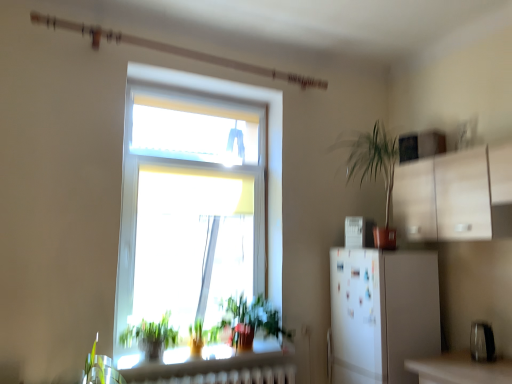
The height and width of the screenshot is (384, 512). What do you see at coordinates (355, 232) in the screenshot?
I see `white glossy refrigerator at right, which appears as the second appliance when ordered from the bottom` at bounding box center [355, 232].

Where is `green leafy plant at lower left, which is counted as the 2th vegetation, starting from the right`? The width and height of the screenshot is (512, 384). green leafy plant at lower left, which is counted as the 2th vegetation, starting from the right is located at coordinates (151, 337).

Between green leafy plant at lower center, acting as the first vegetation starting from the right, and white glossy refrigerator at right, the 1th appliance when ordered from left to right, which one has larger size?

With larger size is green leafy plant at lower center, acting as the first vegetation starting from the right.

From the picture: From a real-world perspective, is green leafy plant at lower center, acting as the first vegetation starting from the right, on top of white glossy refrigerator at right, the 1th appliance when ordered from left to right?

Incorrect, from a real-world perspective, green leafy plant at lower center, acting as the first vegetation starting from the right, is lower than white glossy refrigerator at right, the 1th appliance when ordered from left to right.

Which is behind, point (246, 316) or point (362, 218)?

The point (362, 218) is behind.

Which object is positioned more to the right, white glossy refrigerator at right, which is the first appliance in back-to-front order, or metallic silver toaster at lower right, which is counted as the 2th appliance, starting from the left?

metallic silver toaster at lower right, which is counted as the 2th appliance, starting from the left, is more to the right.

Can you confirm if white glossy refrigerator at right, which is the first appliance in back-to-front order, is taller than metallic silver toaster at lower right, the 2th appliance when ordered from back to front?

Correct, white glossy refrigerator at right, which is the first appliance in back-to-front order, is much taller as metallic silver toaster at lower right, the 2th appliance when ordered from back to front.

From a real-world perspective, which object rests below the other?

metallic silver toaster at lower right, which is counted as the 2th appliance, starting from the left, from a real-world perspective.

Locate an element on the screen. The image size is (512, 384). appliance lying in front of the white glossy refrigerator at right, the 2th appliance when ordered from right to left is located at coordinates (482, 342).

From the metallic silver toaster at lower right, which is counted as the 2th appliance, starting from the left, count the 2nd vegetation to the left and point to it. Please provide its 2D coordinates.

[(151, 337)]

Is green leafy plant at lower left, the first vegetation in the left-to-right sequence, oriented away from metallic silver toaster at lower right, positioned as the 2th appliance in top-to-bottom order?

That's not correct — green leafy plant at lower left, the first vegetation in the left-to-right sequence, is not looking away from metallic silver toaster at lower right, positioned as the 2th appliance in top-to-bottom order.

How far apart are green leafy plant at lower left, which is counted as the 2th vegetation, starting from the right, and metallic silver toaster at lower right, placed as the first appliance when sorted from front to back?

green leafy plant at lower left, which is counted as the 2th vegetation, starting from the right, is 6.62 feet from metallic silver toaster at lower right, placed as the first appliance when sorted from front to back.

Considering the relative sizes of green leafy plant at lower left, which is counted as the 2th vegetation, starting from the right, and metallic silver toaster at lower right, which is counted as the 2th appliance, starting from the left, in the image provided, is green leafy plant at lower left, which is counted as the 2th vegetation, starting from the right, shorter than metallic silver toaster at lower right, which is counted as the 2th appliance, starting from the left,?

No.

Based on their sizes in the image, would you say white glossy refrigerator at right, which is the first appliance in back-to-front order, is bigger or smaller than green leafy plant at lower left, which is counted as the 2th vegetation, starting from the right?

Considering their sizes, white glossy refrigerator at right, which is the first appliance in back-to-front order, takes up less space than green leafy plant at lower left, which is counted as the 2th vegetation, starting from the right.

Find the location of a particular element. This screenshot has width=512, height=384. appliance above the green leafy plant at lower left, which is counted as the 2th vegetation, starting from the right (from the image's perspective) is located at coordinates (355, 232).

From the image's perspective, is white glossy refrigerator at right, acting as the first appliance starting from the top, over green leafy plant at lower left, the first vegetation in the left-to-right sequence?

Yes, from the image's perspective, white glossy refrigerator at right, acting as the first appliance starting from the top, is on top of green leafy plant at lower left, the first vegetation in the left-to-right sequence.

Is white glossy refrigerator at right, which appears as the second appliance when ordered from the bottom, further to camera compared to green leafy plant at lower left, the first vegetation in the left-to-right sequence?

Yes.

Which is behind, green leafy plant at lower left, the first vegetation in the left-to-right sequence, or white glossy refrigerator at right, which is the first appliance in back-to-front order?

Positioned behind is white glossy refrigerator at right, which is the first appliance in back-to-front order.

In the scene shown: Which of these two, green leafy plant at lower left, which is counted as the 2th vegetation, starting from the right, or white glossy refrigerator at right, the second appliance positioned from the front, stands shorter?

Standing shorter between the two is white glossy refrigerator at right, the second appliance positioned from the front.

Is green leafy plant at lower left, which is counted as the 2th vegetation, starting from the right, at the left side of white glossy refrigerator at right, acting as the first appliance starting from the top?

Yes, green leafy plant at lower left, which is counted as the 2th vegetation, starting from the right, is to the left of white glossy refrigerator at right, acting as the first appliance starting from the top.

From a real-world perspective, is green leafy plant at lower left, the first vegetation in the left-to-right sequence, physically located above or below white glossy refrigerator at right, the 2th appliance when ordered from right to left?

green leafy plant at lower left, the first vegetation in the left-to-right sequence, is below white glossy refrigerator at right, the 2th appliance when ordered from right to left.

From a real-world perspective, is green leafy plant at lower center, acting as the first vegetation starting from the right, above or below green leafy plant at lower left, the first vegetation in the left-to-right sequence?

From a real-world perspective, green leafy plant at lower center, acting as the first vegetation starting from the right, is physically above green leafy plant at lower left, the first vegetation in the left-to-right sequence.

Is green leafy plant at lower left, which is counted as the 2th vegetation, starting from the right, located within green leafy plant at lower center, the 2th vegetation from the left?

No.

This screenshot has height=384, width=512. In order to click on vegetation behind the green leafy plant at lower left, which is counted as the 2th vegetation, starting from the right in this screenshot , I will do `click(250, 320)`.

Is green leafy plant at lower center, acting as the first vegetation starting from the right, bigger than green leafy plant at lower left, which is counted as the 2th vegetation, starting from the right?

Yes.

Is metallic silver toaster at lower right, the 1th appliance in the right-to-left sequence, spatially inside green leafy plant at lower left, which is counted as the 2th vegetation, starting from the right, or outside of it?

metallic silver toaster at lower right, the 1th appliance in the right-to-left sequence, is located beyond the bounds of green leafy plant at lower left, which is counted as the 2th vegetation, starting from the right.

Which of these two, metallic silver toaster at lower right, positioned as the 2th appliance in top-to-bottom order, or green leafy plant at lower left, the first vegetation in the left-to-right sequence, stands shorter?

With less height is metallic silver toaster at lower right, positioned as the 2th appliance in top-to-bottom order.

Is metallic silver toaster at lower right, the 1th appliance in the right-to-left sequence, far from green leafy plant at lower left, which is counted as the 2th vegetation, starting from the right?

Absolutely, metallic silver toaster at lower right, the 1th appliance in the right-to-left sequence, is distant from green leafy plant at lower left, which is counted as the 2th vegetation, starting from the right.

Considering the sizes of objects metallic silver toaster at lower right, the 2th appliance when ordered from back to front, and green leafy plant at lower left, which is counted as the 2th vegetation, starting from the right, in the image provided, who is smaller, metallic silver toaster at lower right, the 2th appliance when ordered from back to front, or green leafy plant at lower left, which is counted as the 2th vegetation, starting from the right,?

metallic silver toaster at lower right, the 2th appliance when ordered from back to front, is smaller.

This screenshot has width=512, height=384. Find the location of `appliance behind the green leafy plant at lower center, acting as the first vegetation starting from the right`. appliance behind the green leafy plant at lower center, acting as the first vegetation starting from the right is located at coordinates (355, 232).

I want to click on appliance that is under the white glossy refrigerator at right, the 1th appliance when ordered from left to right (from a real-world perspective), so click(x=482, y=342).

Considering their positions, is green leafy plant at lower center, the 2th vegetation from the left, positioned further to metallic silver toaster at lower right, positioned as the 2th appliance in top-to-bottom order, than white glossy refrigerator at right, the 2th appliance when ordered from right to left?

green leafy plant at lower center, the 2th vegetation from the left, is further to metallic silver toaster at lower right, positioned as the 2th appliance in top-to-bottom order.

Estimate the real-world distances between objects in this image. Which object is further from green leafy plant at lower left, which is counted as the 2th vegetation, starting from the right, white glossy refrigerator at right, which is the first appliance in back-to-front order, or green leafy plant at lower center, acting as the first vegetation starting from the right?

Among the two, white glossy refrigerator at right, which is the first appliance in back-to-front order, is located further to green leafy plant at lower left, which is counted as the 2th vegetation, starting from the right.

When comparing their distances from metallic silver toaster at lower right, the 1th appliance in the right-to-left sequence, does green leafy plant at lower left, which is counted as the 2th vegetation, starting from the right, or white glossy refrigerator at right, the 2th appliance when ordered from right to left, seem further?

Among the two, green leafy plant at lower left, which is counted as the 2th vegetation, starting from the right, is located further to metallic silver toaster at lower right, the 1th appliance in the right-to-left sequence.

Which object lies further to the anchor point white glossy refrigerator at right, which is the first appliance in back-to-front order, metallic silver toaster at lower right, the 1th appliance from the bottom, or green leafy plant at lower center, acting as the first vegetation starting from the right?

Based on the image, metallic silver toaster at lower right, the 1th appliance from the bottom, appears to be further to white glossy refrigerator at right, which is the first appliance in back-to-front order.

When comparing their distances from metallic silver toaster at lower right, the 1th appliance in the right-to-left sequence, does green leafy plant at lower center, acting as the first vegetation starting from the right, or green leafy plant at lower left, which is counted as the 2th vegetation, starting from the right, seem further?

Among the two, green leafy plant at lower left, which is counted as the 2th vegetation, starting from the right, is located further to metallic silver toaster at lower right, the 1th appliance in the right-to-left sequence.

Based on their spatial positions, is green leafy plant at lower center, acting as the first vegetation starting from the right, or white glossy refrigerator at right, acting as the first appliance starting from the top, closer to green leafy plant at lower left, the first vegetation in the left-to-right sequence?

Based on the image, green leafy plant at lower center, acting as the first vegetation starting from the right, appears to be nearer to green leafy plant at lower left, the first vegetation in the left-to-right sequence.

Estimate the real-world distances between objects in this image. Which object is further from green leafy plant at lower center, acting as the first vegetation starting from the right, green leafy plant at lower left, the first vegetation in the left-to-right sequence, or white glossy refrigerator at right, which is the first appliance in back-to-front order?

The object further to green leafy plant at lower center, acting as the first vegetation starting from the right, is white glossy refrigerator at right, which is the first appliance in back-to-front order.

Estimate the real-world distances between objects in this image. Which object is further from metallic silver toaster at lower right, which is counted as the 2th appliance, starting from the left, white glossy refrigerator at right, the 1th appliance when ordered from left to right, or green leafy plant at lower center, the 2th vegetation from the left?

The object further to metallic silver toaster at lower right, which is counted as the 2th appliance, starting from the left, is green leafy plant at lower center, the 2th vegetation from the left.

Locate an element on the screen. The image size is (512, 384). appliance between green leafy plant at lower left, the first vegetation in the left-to-right sequence, and metallic silver toaster at lower right, the 1th appliance in the right-to-left sequence is located at coordinates (x=355, y=232).

Where is `vegetation located between green leafy plant at lower left, which is counted as the 2th vegetation, starting from the right, and white glossy refrigerator at right, the 1th appliance when ordered from left to right, in the left-right direction`? This screenshot has height=384, width=512. vegetation located between green leafy plant at lower left, which is counted as the 2th vegetation, starting from the right, and white glossy refrigerator at right, the 1th appliance when ordered from left to right, in the left-right direction is located at coordinates (250, 320).

Identify the location of vegetation between green leafy plant at lower left, the first vegetation in the left-to-right sequence, and metallic silver toaster at lower right, the 1th appliance from the bottom, in the horizontal direction. This screenshot has height=384, width=512. (250, 320).

Where is `appliance situated between green leafy plant at lower center, the 2th vegetation from the left, and metallic silver toaster at lower right, placed as the first appliance when sorted from front to back, from left to right`? Image resolution: width=512 pixels, height=384 pixels. appliance situated between green leafy plant at lower center, the 2th vegetation from the left, and metallic silver toaster at lower right, placed as the first appliance when sorted from front to back, from left to right is located at coordinates (355, 232).